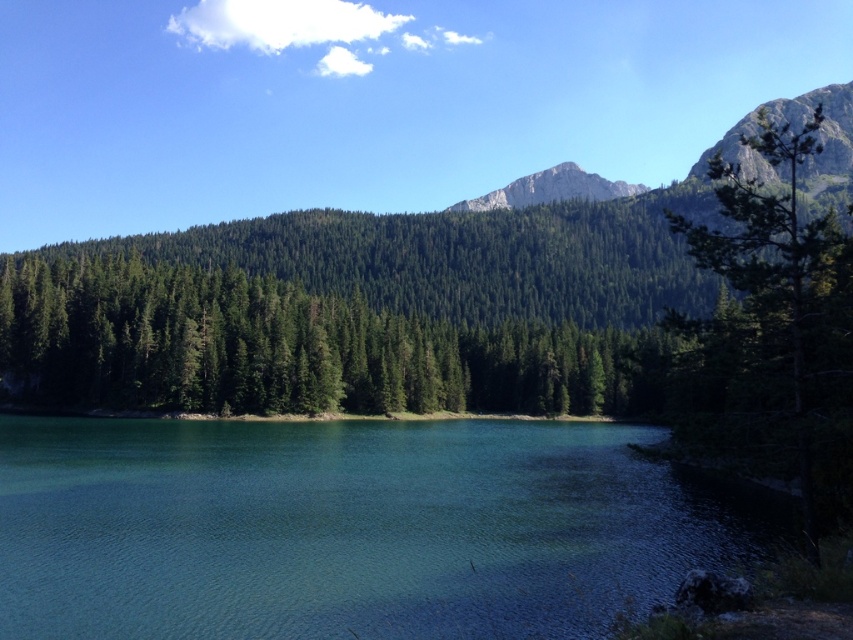
Can you confirm if clear glassy water at center is smaller than rugged stone mountain at upper right?

Yes, clear glassy water at center is smaller than rugged stone mountain at upper right.

Is the position of clear glassy water at center more distant than that of rugged stone mountain at upper right?

No, clear glassy water at center is in front of rugged stone mountain at upper right.

Which is in front, point (444, 627) or point (715, 150)?

Positioned in front is point (444, 627).

Where is `clear glassy water at center`? Image resolution: width=853 pixels, height=640 pixels. clear glassy water at center is located at coordinates coord(352,529).

Does clear glassy water at center have a smaller size compared to rugged granite mountain at upper center?

Correct, clear glassy water at center occupies less space than rugged granite mountain at upper center.

Is clear glassy water at center positioned in front of rugged granite mountain at upper center?

Yes, clear glassy water at center is closer to the viewer.

At what (x,y) coordinates should I click in order to perform the action: click on clear glassy water at center. Please return your answer as a coordinate pair (x, y). This screenshot has width=853, height=640. Looking at the image, I should click on (352, 529).

Who is lower down, clear glassy water at center or green matte tree at center?

clear glassy water at center

Is point (161, 545) positioned behind point (537, 321)?

No, it is not.

Where is `clear glassy water at center`? clear glassy water at center is located at coordinates (352, 529).